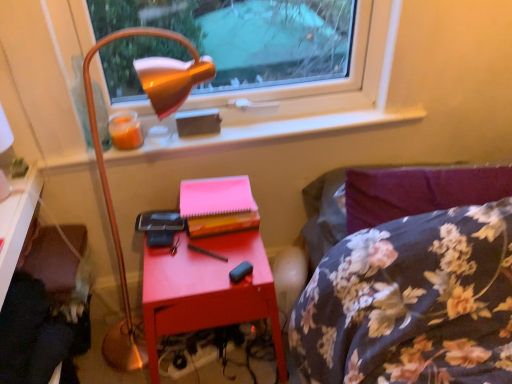
Question: Is matte wood desk at lower left at the left side of velvet purple swivel chair at lower left?

Choices:
 (A) yes
 (B) no

Answer: (A)

Question: Is matte wood desk at lower left thinner than velvet purple swivel chair at lower left?

Choices:
 (A) yes
 (B) no

Answer: (A)

Question: Does matte wood desk at lower left have a smaller size compared to velvet purple swivel chair at lower left?

Choices:
 (A) yes
 (B) no

Answer: (A)

Question: Is matte wood desk at lower left far from velvet purple swivel chair at lower left?

Choices:
 (A) no
 (B) yes

Answer: (A)

Question: Can you confirm if matte wood desk at lower left is taller than velvet purple swivel chair at lower left?

Choices:
 (A) no
 (B) yes

Answer: (A)

Question: From the image's perspective, is matte wood desk at lower left below velvet purple swivel chair at lower left?

Choices:
 (A) yes
 (B) no

Answer: (B)

Question: Is matte wood desk at lower left closer to the viewer compared to wooden table at lower left?

Choices:
 (A) no
 (B) yes

Answer: (B)

Question: Is matte wood desk at lower left outside of wooden table at lower left?

Choices:
 (A) yes
 (B) no

Answer: (A)

Question: Considering the relative sizes of matte wood desk at lower left and wooden table at lower left in the image provided, is matte wood desk at lower left thinner than wooden table at lower left?

Choices:
 (A) yes
 (B) no

Answer: (A)

Question: Are matte wood desk at lower left and wooden table at lower left located far from each other?

Choices:
 (A) yes
 (B) no

Answer: (B)

Question: From the image's perspective, would you say matte wood desk at lower left is shown under wooden table at lower left?

Choices:
 (A) no
 (B) yes

Answer: (A)

Question: Considering the relative positions of matte wood desk at lower left and wooden table at lower left in the image provided, is matte wood desk at lower left behind wooden table at lower left?

Choices:
 (A) yes
 (B) no

Answer: (B)

Question: Considering the relative sizes of velvet purple swivel chair at lower left and pink paper at center in the image provided, is velvet purple swivel chair at lower left wider than pink paper at center?

Choices:
 (A) yes
 (B) no

Answer: (B)